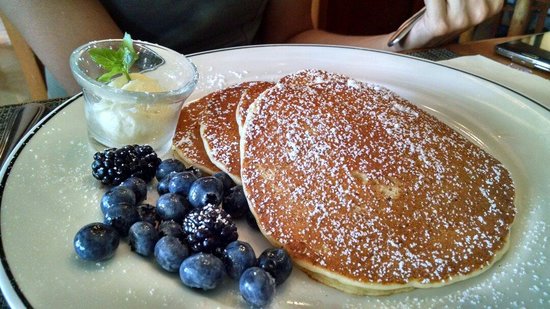
Locate an element on the screen. white napkin on the side of the plate on the right side of the photo is located at coordinates (505, 75).